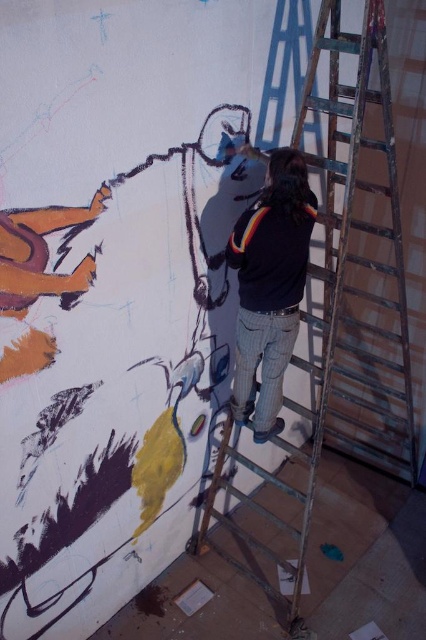
Question: Observing the image, what is the correct spatial positioning of metallic silver ladder at center in reference to black sweater at center?

Choices:
 (A) right
 (B) left

Answer: (A)

Question: Can you confirm if metallic silver ladder at center is smaller than black sweater at center?

Choices:
 (A) no
 (B) yes

Answer: (A)

Question: Can you confirm if metallic silver ladder at center is positioned above black sweater at center?

Choices:
 (A) yes
 (B) no

Answer: (B)

Question: Among these objects, which one is nearest to the camera?

Choices:
 (A) metallic silver ladder at center
 (B) black sweater at center

Answer: (A)

Question: Which object appears closest to the camera in this image?

Choices:
 (A) black sweater at center
 (B) metallic silver ladder at center

Answer: (B)

Question: Which object is farther from the camera taking this photo?

Choices:
 (A) metallic silver ladder at center
 (B) black sweater at center

Answer: (B)